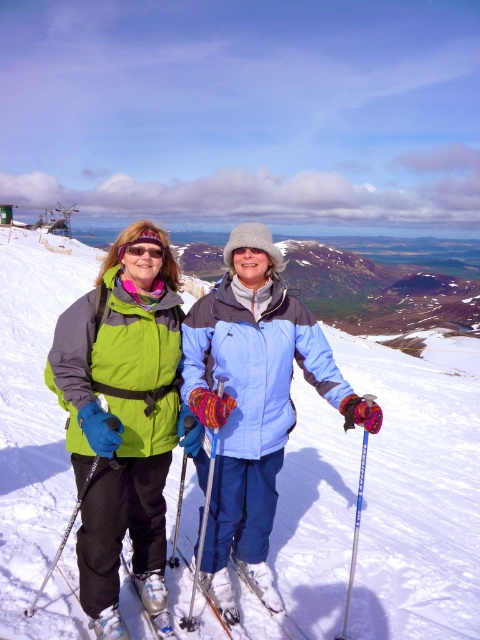
You are a photographer standing at the camera position and want to take a photo of the matte blue ski pole at center. Can you reach the pole to adjust it without moving from your current position? The average person can reach about 2.5 meters.

The matte blue ski pole at center and camera are 13.42 feet apart from each other. Since 13.42 feet is approximately 4.09 meters, which is longer than the average person can reach, you cannot adjust the pole without moving.

You are a photographer trying to capture a photo of the matte green jacket at left and the matte blue ski pole at center. Since you want both subjects to be in focus, you need to know their heights. Can you tell me which one is taller?

The matte green jacket at left is much taller than the matte blue ski pole at center, so the jacket is taller and will be in focus.